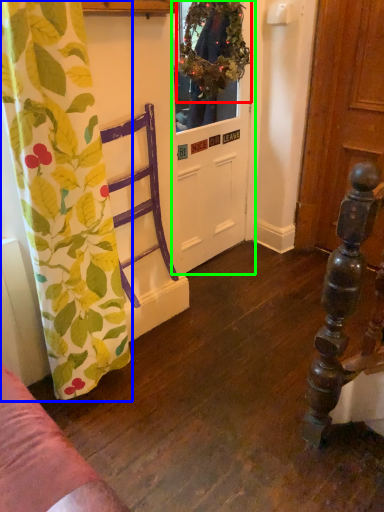
Question: Considering the real-world distances, which object is closest to floral arrangement (highlighted by a red box)? curtain (highlighted by a blue box) or door (highlighted by a green box).

Choices:
 (A) curtain
 (B) door

Answer: (B)